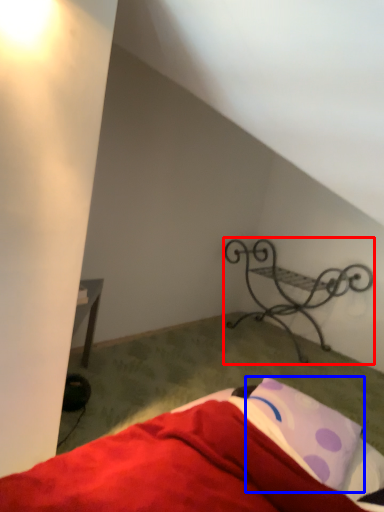
Question: Which point is closer to the camera, furniture (highlighted by a red box) or pillow (highlighted by a blue box)?

Choices:
 (A) furniture
 (B) pillow

Answer: (B)